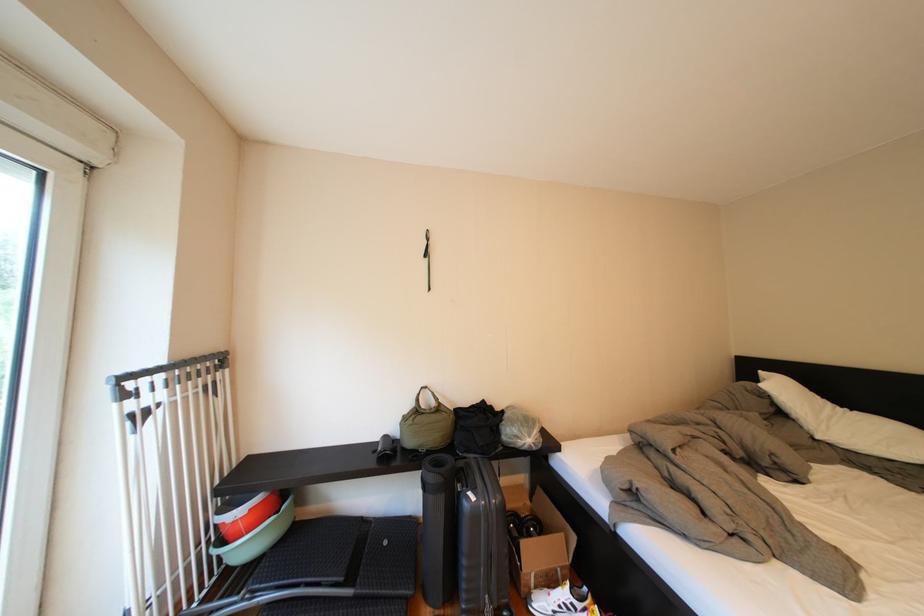
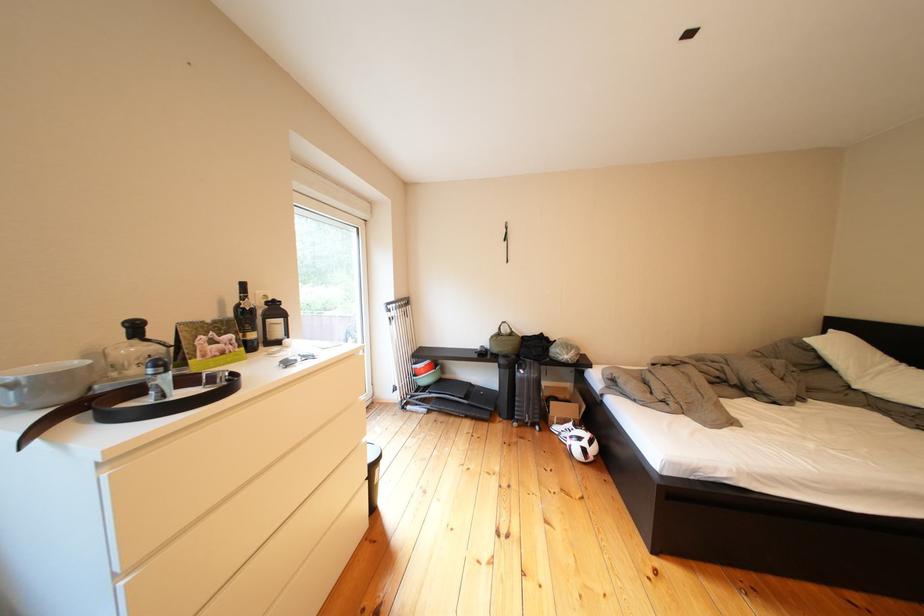
In the second image, find the point that corresponds to point 431,405 in the first image.

(514, 334)